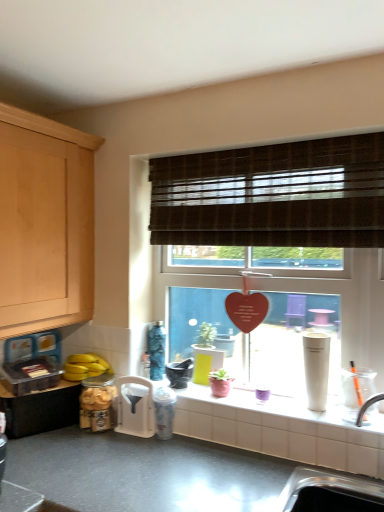
The height and width of the screenshot is (512, 384). I want to click on empty space that is ontop of matte white tile at center (from a real-world perspective), so click(x=252, y=397).